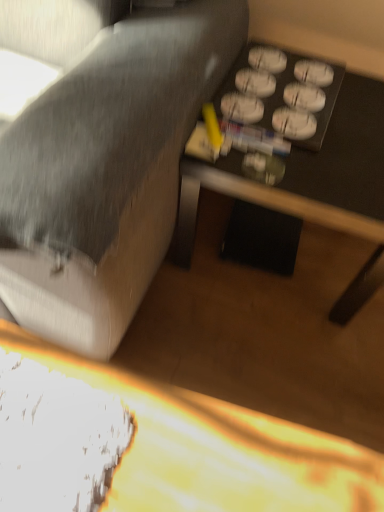
Question: From a real-world perspective, is black plastic table at lower right, the 2th table when ordered from bottom to top, above or below wooden table at center, which is the second table from top to bottom?

Choices:
 (A) below
 (B) above

Answer: (B)

Question: Relative to wooden table at center, which is the second table from top to bottom, is black plastic table at lower right, acting as the first table starting from the top, in front or behind?

Choices:
 (A) behind
 (B) front

Answer: (A)

Question: Which of these objects is positioned closest to the textured gray fabric couch at center?

Choices:
 (A) black plastic table at lower right, acting as the first table starting from the top
 (B) wooden table at center, which is the second table from top to bottom

Answer: (A)

Question: Based on their relative distances, which object is farther from the wooden table at center, which appears as the first table when ordered from the bottom?

Choices:
 (A) textured gray fabric couch at center
 (B) black plastic table at lower right, acting as the first table starting from the top

Answer: (B)